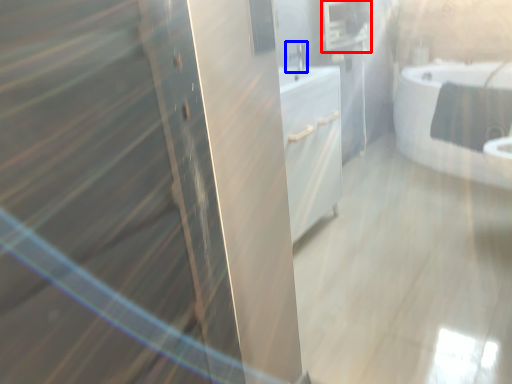
Question: Which of the following is the closest to the observer, medicine cabinet (highlighted by a red box) or faucet (highlighted by a blue box)?

Choices:
 (A) medicine cabinet
 (B) faucet

Answer: (B)